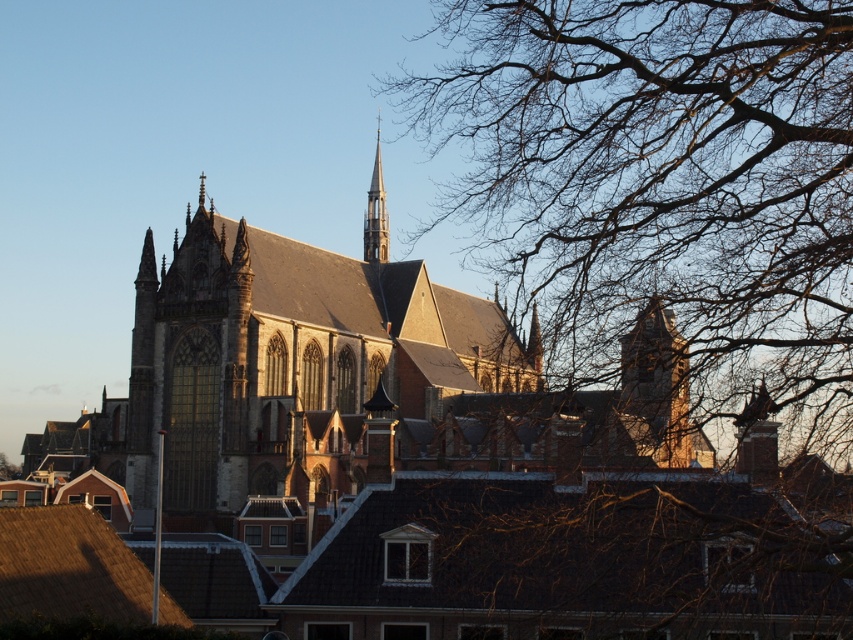
Between point (515, 227) and point (375, 182), which one is positioned in front?

Point (375, 182) is more forward.

Does bare branches at upper right lie behind smooth gray steeple at center?

No, it is not.

Is point (579, 125) positioned after point (378, 188)?

No, it is in front of (378, 188).

The height and width of the screenshot is (640, 853). I want to click on bare branches at upper right, so click(662, 186).